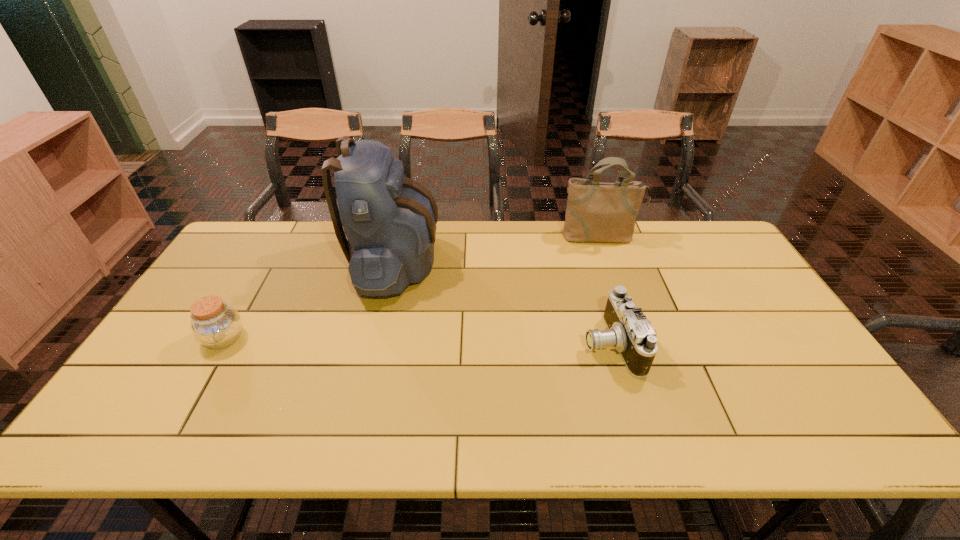
Point out which object is positioned as the nearest to the shoulder bag. Please provide its 2D coordinates. Your answer should be formatted as a tuple, i.e. [(x, y)], where the tuple contains the x and y coordinates of a point satisfying the conditions above.

[(629, 331)]

Image resolution: width=960 pixels, height=540 pixels. Find the location of `free space that satisfies the following two spatial constraints: 1. at the front pocket of the tallest object; 2. on the front side of the leftmost object`. free space that satisfies the following two spatial constraints: 1. at the front pocket of the tallest object; 2. on the front side of the leftmost object is located at coordinates (379, 339).

The width and height of the screenshot is (960, 540). Identify the location of vacant space that satisfies the following two spatial constraints: 1. on the front-facing side of the shoulder bag; 2. at the lens of the camera. (638, 344).